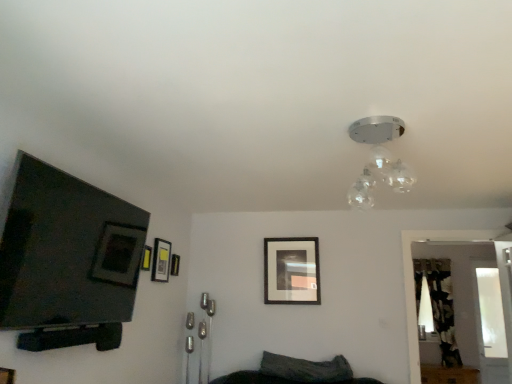
Question: Does matte black picture frame at upper left, the 2th picture frame from the right, come in front of matte black picture frame at upper left, the fourth picture frame in the back-to-front sequence?

Choices:
 (A) yes
 (B) no

Answer: (B)

Question: Does matte black picture frame at upper left, arranged as the third picture frame when viewed from the front, have a smaller size compared to matte black picture frame at upper left, positioned as the 1th picture frame in front-to-back order?

Choices:
 (A) no
 (B) yes

Answer: (A)

Question: Is matte black picture frame at upper left, the 2th picture frame from the right, to the left of matte black picture frame at upper left, positioned as the 1th picture frame in front-to-back order, from the viewer's perspective?

Choices:
 (A) yes
 (B) no

Answer: (B)

Question: Can matte black picture frame at upper left, which is the 4th picture frame in right-to-left order, be found inside matte black picture frame at upper left, placed as the third picture frame when sorted from left to right?

Choices:
 (A) yes
 (B) no

Answer: (B)

Question: Is matte black picture frame at upper left, arranged as the third picture frame when viewed from the front, shorter than matte black picture frame at upper left, the fourth picture frame in the back-to-front sequence?

Choices:
 (A) yes
 (B) no

Answer: (B)

Question: Is matte black picture frame at upper left, arranged as the third picture frame when viewed from the front, positioned behind matte black picture frame at upper left, the first picture frame viewed from the left?

Choices:
 (A) yes
 (B) no

Answer: (A)

Question: Is transparent glass door at right thinner than dark gray fabric pillow at lower center?

Choices:
 (A) yes
 (B) no

Answer: (A)

Question: Is transparent glass door at right not close to dark gray fabric pillow at lower center?

Choices:
 (A) yes
 (B) no

Answer: (A)

Question: Can you confirm if transparent glass door at right is bigger than dark gray fabric pillow at lower center?

Choices:
 (A) no
 (B) yes

Answer: (B)

Question: Can dark gray fabric pillow at lower center be found inside transparent glass door at right?

Choices:
 (A) yes
 (B) no

Answer: (B)

Question: Considering the relative positions of transparent glass door at right and dark gray fabric pillow at lower center in the image provided, is transparent glass door at right behind dark gray fabric pillow at lower center?

Choices:
 (A) no
 (B) yes

Answer: (A)

Question: From the image's perspective, does transparent glass door at right appear lower than dark gray fabric pillow at lower center?

Choices:
 (A) no
 (B) yes

Answer: (A)

Question: From a real-world perspective, is matte black picture frame at center, the 1th picture frame viewed from the right, over transparent glass door at right?

Choices:
 (A) yes
 (B) no

Answer: (A)